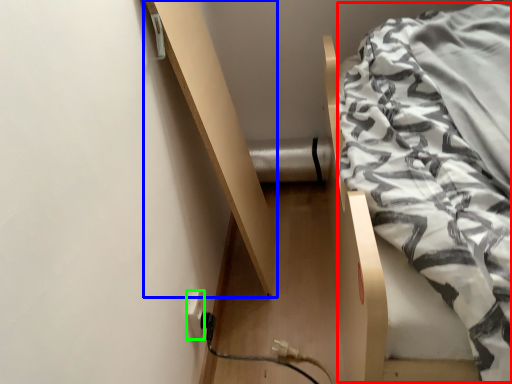
Question: Which object is positioned closest to blanket (highlighted by a red box)? Select from shelf (highlighted by a blue box) and electric outlet (highlighted by a green box).

Choices:
 (A) shelf
 (B) electric outlet

Answer: (A)